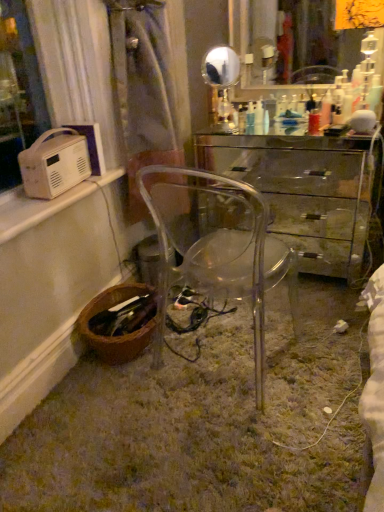
Question: From a real-world perspective, does white plastic radio at upper left, positioned as the 1th appliance in back-to-front order, sit lower than transparent glass desk at center?

Choices:
 (A) yes
 (B) no

Answer: (B)

Question: Is transparent glass desk at center a part of white plastic radio at upper left, positioned as the 1th appliance in back-to-front order?

Choices:
 (A) yes
 (B) no

Answer: (B)

Question: Is white plastic radio at upper left, the 2th appliance from the front, taller than transparent glass desk at center?

Choices:
 (A) no
 (B) yes

Answer: (A)

Question: Can you confirm if white plastic radio at upper left, the 2th appliance from the front, is shorter than transparent glass desk at center?

Choices:
 (A) yes
 (B) no

Answer: (A)

Question: In terms of width, does transparent plastic chair at center look wider or thinner when compared to transparent glass desk at center?

Choices:
 (A) wide
 (B) thin

Answer: (A)

Question: Relative to transparent glass desk at center, is transparent plastic chair at center in front or behind?

Choices:
 (A) behind
 (B) front

Answer: (B)

Question: From a real-world perspective, is transparent plastic chair at center physically located above or below transparent glass desk at center?

Choices:
 (A) above
 (B) below

Answer: (A)

Question: Based on their sizes in the image, would you say transparent plastic chair at center is bigger or smaller than transparent glass desk at center?

Choices:
 (A) big
 (B) small

Answer: (B)

Question: Is point (259, 120) positioned closer to the camera than point (109, 295)?

Choices:
 (A) farther
 (B) closer

Answer: (A)

Question: Visually, is translucent plastic bottle at center positioned to the left or to the right of brown woven basket at lower left?

Choices:
 (A) right
 (B) left

Answer: (A)

Question: Is translucent plastic bottle at center wider or thinner than brown woven basket at lower left?

Choices:
 (A) thin
 (B) wide

Answer: (A)

Question: In the image, is translucent plastic bottle at center positioned in front of or behind brown woven basket at lower left?

Choices:
 (A) front
 (B) behind

Answer: (B)

Question: Relative to transparent glass desk at center, is white plastic radio at upper left, positioned as the 1th appliance in back-to-front order, in front or behind?

Choices:
 (A) front
 (B) behind

Answer: (A)

Question: From their relative heights in the image, would you say white plastic radio at upper left, the 2th appliance from the front, is taller or shorter than transparent glass desk at center?

Choices:
 (A) tall
 (B) short

Answer: (B)